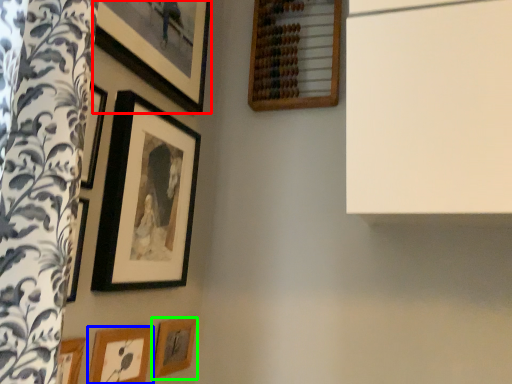
Question: Which is farther away from picture frame (highlighted by a red box)? picture frame (highlighted by a blue box) or picture frame (highlighted by a green box)?

Choices:
 (A) picture frame
 (B) picture frame

Answer: (B)